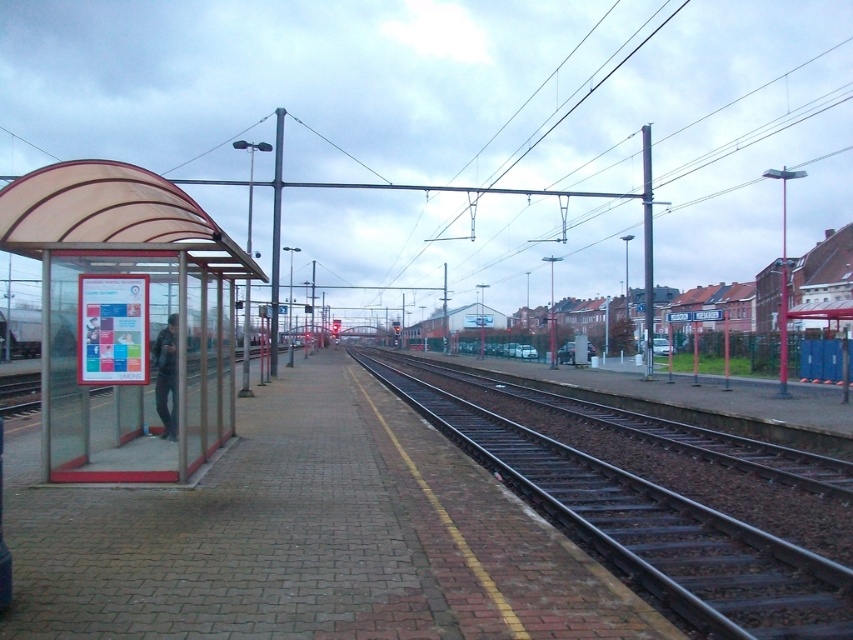
Does black metal train track at center have a larger size compared to dark gray jacket at left?

Indeed, black metal train track at center has a larger size compared to dark gray jacket at left.

This screenshot has height=640, width=853. In order to click on black metal train track at center in this screenshot , I will do `click(648, 529)`.

Does translucent plastic bus stop at left have a greater width compared to black metal train track at center?

Indeed, translucent plastic bus stop at left has a greater width compared to black metal train track at center.

From the picture: Who is more forward, (219, 276) or (685, 598)?

Positioned in front is point (685, 598).

Locate an element on the screen. This screenshot has width=853, height=640. translucent plastic bus stop at left is located at coordinates (125, 317).

Does point (71, 380) come closer to viewer compared to point (158, 403)?

Yes.

Is translucent plastic bus stop at left in front of dark gray jacket at left?

Yes, translucent plastic bus stop at left is in front of dark gray jacket at left.

Where is `translucent plastic bus stop at left`? The height and width of the screenshot is (640, 853). translucent plastic bus stop at left is located at coordinates (125, 317).

You are a GUI agent. You are given a task and a screenshot of the screen. Output one action in this format:
    pyautogui.click(x=<x>, y=<y>)
    Task: Click on the translucent plastic bus stop at left
    This screenshot has width=853, height=640.
    Given the screenshot: What is the action you would take?
    pyautogui.click(x=125, y=317)